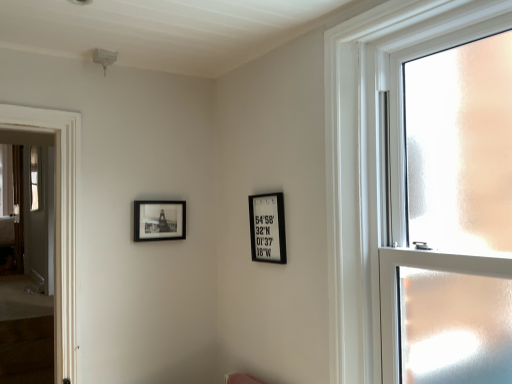
Question: From the image's perspective, relative to black matte picture frame at upper left, which ranks as the first picture frame in left-to-right order, is black matte picture frame at upper center, the 2th picture frame viewed from the left, above or below?

Choices:
 (A) below
 (B) above

Answer: (A)

Question: Based on their sizes in the image, would you say black matte picture frame at upper center, the 2th picture frame viewed from the left, is bigger or smaller than black matte picture frame at upper left, which ranks as the first picture frame in left-to-right order?

Choices:
 (A) small
 (B) big

Answer: (B)

Question: Which of these objects is positioned closest to the black matte picture frame at upper center, positioned as the first picture frame in right-to-left order?

Choices:
 (A) black matte picture frame at upper left, which ranks as the first picture frame in left-to-right order
 (B) clear glass window at right

Answer: (B)

Question: Based on their relative distances, which object is nearer to the black matte picture frame at upper left, which ranks as the first picture frame in left-to-right order?

Choices:
 (A) clear glass window at right
 (B) black matte picture frame at upper center, positioned as the first picture frame in right-to-left order

Answer: (B)